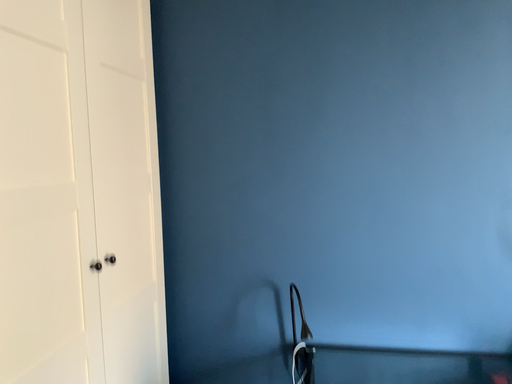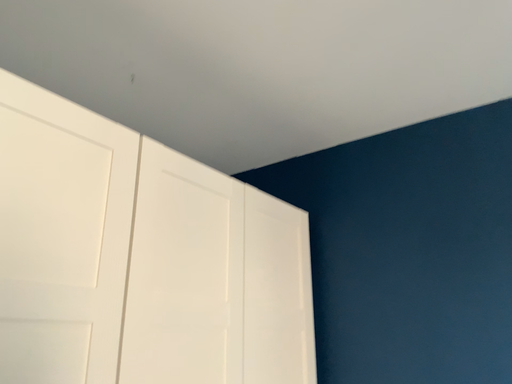
Question: How did the camera likely rotate when shooting the video?

Choices:
 (A) rotated downward
 (B) rotated upward

Answer: (B)